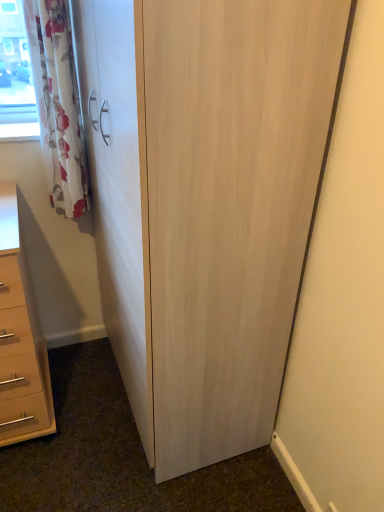
Describe the element at coordinates (20, 338) in the screenshot. This screenshot has height=512, width=384. I see `matte beige chest of drawers at lower left` at that location.

What is the approximate width of white floral fabric curtain at upper left?

white floral fabric curtain at upper left is 7.05 inches in width.

The image size is (384, 512). I want to click on matte beige chest of drawers at lower left, so click(20, 338).

Measure the distance between matte beige chest of drawers at lower left and light wood cupboard at center.

matte beige chest of drawers at lower left is 22.12 inches away from light wood cupboard at center.

Could you tell me if matte beige chest of drawers at lower left is facing light wood cupboard at center?

No.

Would you say matte beige chest of drawers at lower left is to the left or to the right of light wood cupboard at center in the picture?

matte beige chest of drawers at lower left is positioned on light wood cupboard at center's left side.

Is matte beige chest of drawers at lower left next to light wood cupboard at center?

matte beige chest of drawers at lower left and light wood cupboard at center are not in contact.

Would you say light wood cupboard at center is a long distance from white floral fabric curtain at upper left?

No, there isn't a large distance between light wood cupboard at center and white floral fabric curtain at upper left.

From the image's perspective, which is below, light wood cupboard at center or white floral fabric curtain at upper left?

light wood cupboard at center is shown below in the image.

Considering the relative sizes of light wood cupboard at center and white floral fabric curtain at upper left in the image provided, is light wood cupboard at center wider than white floral fabric curtain at upper left?

Yes, light wood cupboard at center is wider than white floral fabric curtain at upper left.

Is white floral fabric curtain at upper left aimed at matte beige chest of drawers at lower left?

No, white floral fabric curtain at upper left is not oriented towards matte beige chest of drawers at lower left.

Which is more to the right, white floral fabric curtain at upper left or matte beige chest of drawers at lower left?

white floral fabric curtain at upper left is more to the right.

Considering the sizes of objects white floral fabric curtain at upper left and matte beige chest of drawers at lower left in the image provided, who is bigger, white floral fabric curtain at upper left or matte beige chest of drawers at lower left?

Bigger between the two is matte beige chest of drawers at lower left.

Is white floral fabric curtain at upper left touching matte beige chest of drawers at lower left?

They are not placed beside each other.

Can you tell me how much white floral fabric curtain at upper left and light wood cupboard at center differ in facing direction?

The angular difference between white floral fabric curtain at upper left and light wood cupboard at center is 90 degrees.

Between white floral fabric curtain at upper left and light wood cupboard at center, which one has larger size?

With larger size is light wood cupboard at center.

Visually, is white floral fabric curtain at upper left positioned to the left or to the right of light wood cupboard at center?

From the image, it's evident that white floral fabric curtain at upper left is to the left of light wood cupboard at center.

Which object is wider, white floral fabric curtain at upper left or light wood cupboard at center?

Wider between the two is light wood cupboard at center.

Based on the photo, would you say white floral fabric curtain at upper left is part of matte beige chest of drawers at lower left's contents?

No, white floral fabric curtain at upper left is not inside matte beige chest of drawers at lower left.

Can you confirm if matte beige chest of drawers at lower left is bigger than white floral fabric curtain at upper left?

Yes, matte beige chest of drawers at lower left is bigger than white floral fabric curtain at upper left.

Does matte beige chest of drawers at lower left have a greater width compared to white floral fabric curtain at upper left?

Yes, matte beige chest of drawers at lower left is wider than white floral fabric curtain at upper left.

This screenshot has height=512, width=384. Identify the location of the chest of drawers below the light wood cupboard at center (from a real-world perspective). (20, 338).

Is light wood cupboard at center thinner than matte beige chest of drawers at lower left?

Indeed, light wood cupboard at center has a lesser width compared to matte beige chest of drawers at lower left.

From the image's perspective, is light wood cupboard at center on matte beige chest of drawers at lower left?

Correct, light wood cupboard at center appears higher than matte beige chest of drawers at lower left in the image.

In the scene shown: Is light wood cupboard at center completely or partially outside of matte beige chest of drawers at lower left?

Absolutely, light wood cupboard at center is external to matte beige chest of drawers at lower left.

In the image, there is a light wood cupboard at center. Where is `the chest of drawers below it (from a real-world perspective)`? The image size is (384, 512). the chest of drawers below it (from a real-world perspective) is located at coordinates (20, 338).

This screenshot has height=512, width=384. What are the coordinates of `cupboard lying below the white floral fabric curtain at upper left (from the image's perspective)` in the screenshot? It's located at (206, 205).

Based on their spatial positions, is white floral fabric curtain at upper left or matte beige chest of drawers at lower left further from light wood cupboard at center?

matte beige chest of drawers at lower left is further to light wood cupboard at center.

Based on their spatial positions, is white floral fabric curtain at upper left or light wood cupboard at center further from matte beige chest of drawers at lower left?

light wood cupboard at center is further to matte beige chest of drawers at lower left.

When comparing their distances from light wood cupboard at center, does matte beige chest of drawers at lower left or white floral fabric curtain at upper left seem further?

matte beige chest of drawers at lower left lies further to light wood cupboard at center than the other object.

Which object lies further to the anchor point white floral fabric curtain at upper left, light wood cupboard at center or matte beige chest of drawers at lower left?

light wood cupboard at center is positioned further to the anchor white floral fabric curtain at upper left.

Looking at the image, which one is located closer to matte beige chest of drawers at lower left, light wood cupboard at center or white floral fabric curtain at upper left?

white floral fabric curtain at upper left is closer to matte beige chest of drawers at lower left.

Based on their spatial positions, is matte beige chest of drawers at lower left or light wood cupboard at center closer to white floral fabric curtain at upper left?

matte beige chest of drawers at lower left lies closer to white floral fabric curtain at upper left than the other object.

Where is `cupboard that lies between white floral fabric curtain at upper left and matte beige chest of drawers at lower left from top to bottom`? cupboard that lies between white floral fabric curtain at upper left and matte beige chest of drawers at lower left from top to bottom is located at coordinates (206, 205).